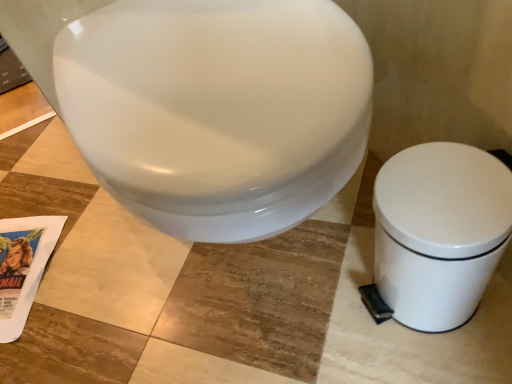
At what (x,y) coordinates should I click in order to perform the action: click on free point above white glossy trash can at lower right (from a real-world perspective). Please return your answer as a coordinate pair (x, y). The width and height of the screenshot is (512, 384). Looking at the image, I should click on (440, 195).